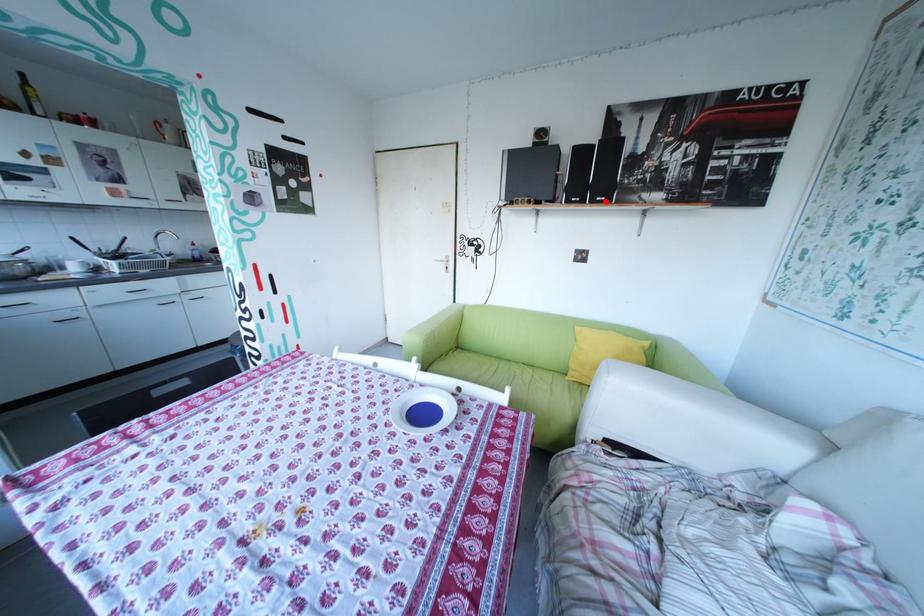
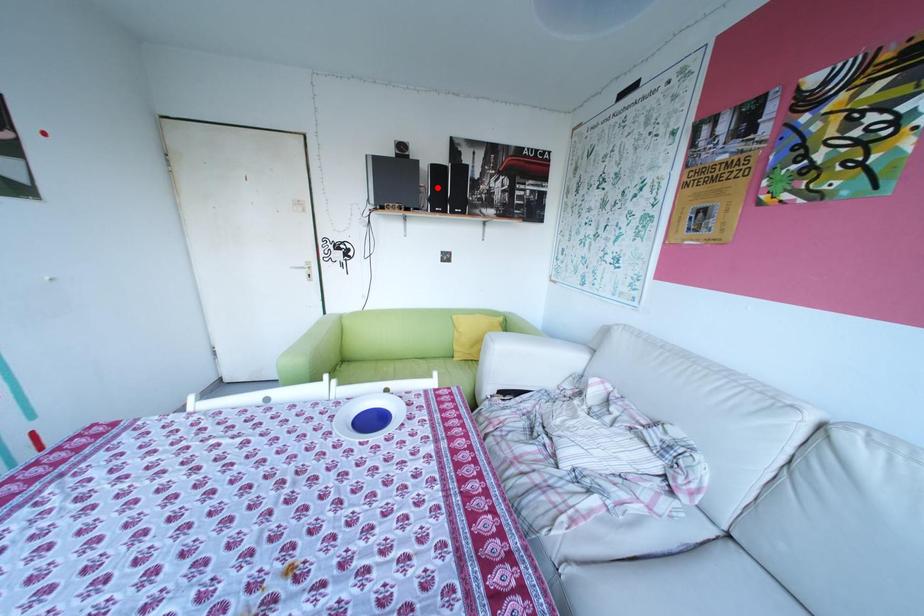
I am providing you with two images of the same scene from different viewpoints. A red point is marked on the first image and another point is marked on the second image. Is the marked point in image1 the same physical position as the marked point in image2?

No